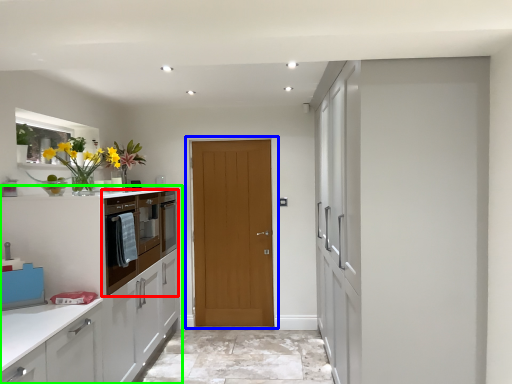
Question: Which object is positioned farthest from cabinetry (highlighted by a red box)? Select from door (highlighted by a blue box) and cabinetry (highlighted by a green box).

Choices:
 (A) door
 (B) cabinetry

Answer: (A)